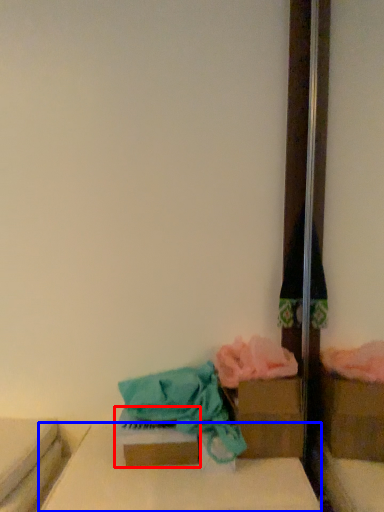
Question: Which object is closer to the camera taking this photo, storage box (highlighted by a red box) or furniture (highlighted by a blue box)?

Choices:
 (A) storage box
 (B) furniture

Answer: (B)